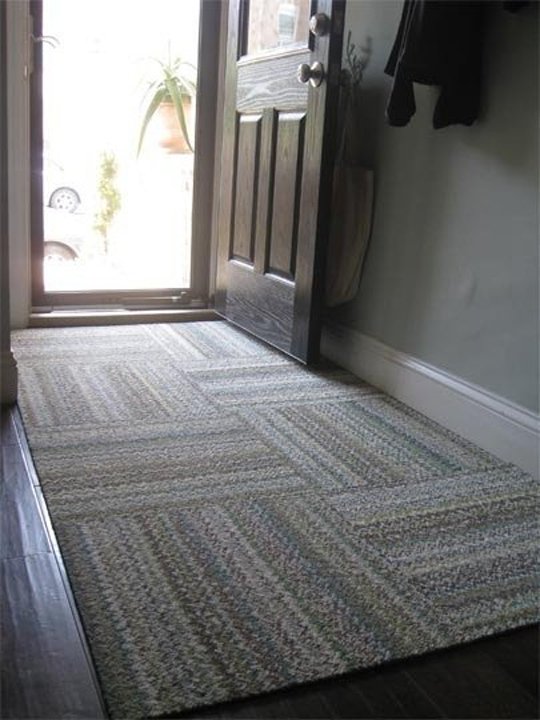
What are the coordinates of `bag hanging from door knob` in the screenshot? It's located at (340, 173).